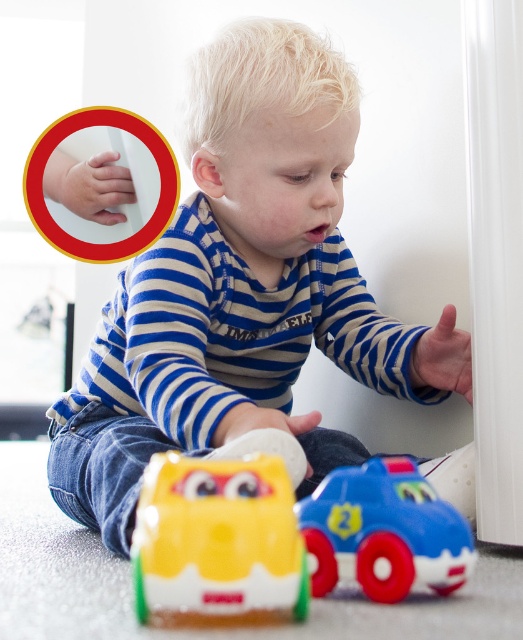
Question: Which object is the closest to the matte plastic hand at upper left?

Choices:
 (A) blue plastic toy car at lower center
 (B) rubberized yellow car at lower center

Answer: (A)

Question: Is rubberized yellow car at lower center above blue plastic toy car at lower center?

Choices:
 (A) yes
 (B) no

Answer: (A)

Question: Can you confirm if matte plastic hand at upper left is bigger than blue plastic toy car at lower center?

Choices:
 (A) yes
 (B) no

Answer: (A)

Question: Estimate the real-world distances between objects in this image. Which object is closer to the blue plastic toy car at lower center?

Choices:
 (A) matte plastic hand at upper left
 (B) rubberized yellow car at lower center

Answer: (B)

Question: Is matte plastic hand at upper left further to camera compared to rubberized yellow car at lower center?

Choices:
 (A) yes
 (B) no

Answer: (A)

Question: Estimate the real-world distances between objects in this image. Which object is closer to the blue plastic toy car at lower center?

Choices:
 (A) rubberized yellow car at lower center
 (B) matte plastic hand at upper left

Answer: (A)